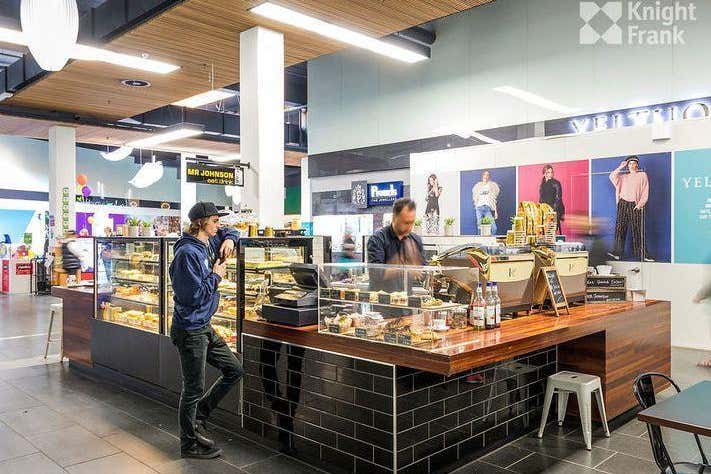
Identify the location of table. This screenshot has height=474, width=711. (685, 417).